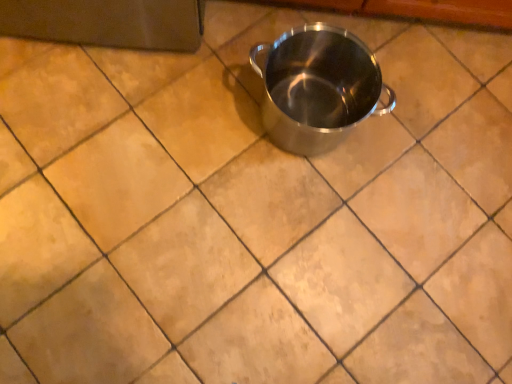
What are the coordinates of `vacant space behind shiny metallic pot at center` in the screenshot? It's located at (329, 30).